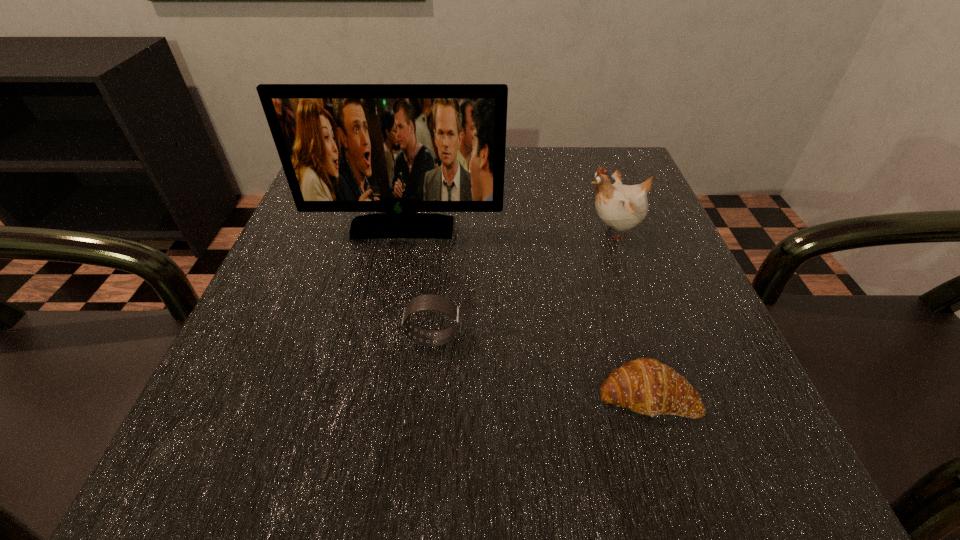
At what (x,y) coordinates should I click in order to perform the action: click on free spot between the third tallest object and the shortest object. Please return your answer as a coordinate pair (x, y). This screenshot has width=960, height=540. Looking at the image, I should click on (540, 367).

At what (x,y) coordinates should I click in order to perform the action: click on unoccupied position between the monitor and the watch. Please return your answer as a coordinate pair (x, y). Looking at the image, I should click on (419, 284).

Image resolution: width=960 pixels, height=540 pixels. Find the location of `vacant space that is in between the tallest object and the second shortest object`. vacant space that is in between the tallest object and the second shortest object is located at coordinates (419, 284).

Find the location of a particular element. free space that is in between the crescent roll and the bird is located at coordinates (630, 313).

Find the location of `the second closest object relative to the crescent roll`. the second closest object relative to the crescent roll is located at coordinates (622, 207).

What are the coordinates of `object that is the closest to the third shortest object` in the screenshot? It's located at (399, 149).

You are a GUI agent. You are given a task and a screenshot of the screen. Output one action in this format:
    pyautogui.click(x=<x>, y=<y>)
    Task: Click on the vacant space that satisfies the following two spatial constraints: 1. on the face of the second nearest object; 2. on the right side of the crescent roll
    This screenshot has height=540, width=960.
    Given the screenshot: What is the action you would take?
    pyautogui.click(x=428, y=395)

Identify the location of vacant area in the image that satisfies the following two spatial constraints: 1. on the face of the crescent roll; 2. on the right side of the third farthest object. (428, 395).

Image resolution: width=960 pixels, height=540 pixels. What are the coordinates of `vacant space that satisfies the following two spatial constraints: 1. on the face of the crescent roll; 2. on the right side of the watch` in the screenshot? It's located at (428, 395).